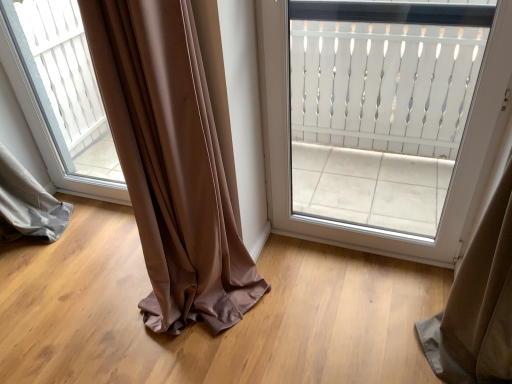
What do you see at coordinates (49, 131) in the screenshot?
I see `transparent glass window at center` at bounding box center [49, 131].

What is the approximate height of transparent glass window at center?

The height of transparent glass window at center is 3.46 feet.

In order to click on transparent glass window at center in this screenshot , I will do `click(49, 131)`.

In order to face white textured door at upper center, should I rotate leftwards or rightwards?

A 14.582 degree turn to the right will do.

This screenshot has height=384, width=512. What do you see at coordinates (354, 225) in the screenshot? I see `white textured door at upper center` at bounding box center [354, 225].

Measure the distance between white textured door at upper center and camera.

The depth of white textured door at upper center is 3.75 feet.

Find the location of a particular element. This screenshot has width=512, height=384. white textured door at upper center is located at coordinates (354, 225).

Where is `transparent glass window at center`? The width and height of the screenshot is (512, 384). transparent glass window at center is located at coordinates (49, 131).

Is transparent glass window at center to the left of white textured door at upper center from the viewer's perspective?

Yes, transparent glass window at center is to the left of white textured door at upper center.

Is transparent glass window at center in front of or behind white textured door at upper center in the image?

transparent glass window at center is behind white textured door at upper center.

Is point (30, 123) positioned before point (375, 230)?

No.

From the image's perspective, is transparent glass window at center below white textured door at upper center?

No, from the image's perspective, transparent glass window at center is not beneath white textured door at upper center.

From a real-world perspective, which is physically above, transparent glass window at center or white textured door at upper center?

In real-world perspective, white textured door at upper center is above.

Can you confirm if transparent glass window at center is thinner than white textured door at upper center?

Yes.

Can you confirm if transparent glass window at center is shorter than white textured door at upper center?

Yes, transparent glass window at center is shorter than white textured door at upper center.

Considering the relative sizes of transparent glass window at center and white textured door at upper center in the image provided, is transparent glass window at center smaller than white textured door at upper center?

Yes, transparent glass window at center is smaller than white textured door at upper center.

Is white textured door at upper center completely or partially inside transparent glass window at center?

No, white textured door at upper center is not inside transparent glass window at center.

Are transparent glass window at center and white textured door at upper center located far from each other?

Yes, transparent glass window at center and white textured door at upper center are quite far apart.

Is transparent glass window at center facing towards white textured door at upper center?

No, transparent glass window at center is not aimed at white textured door at upper center.

I want to click on door below the transparent glass window at center (from the image's perspective), so click(354, 225).

Which is more to the left, white textured door at upper center or transparent glass window at center?

Positioned to the left is transparent glass window at center.

Which object is further away from the camera taking this photo, white textured door at upper center or transparent glass window at center?

transparent glass window at center is behind.

Is point (424, 243) closer or farther from the camera than point (28, 114)?

Point (424, 243) appears to be closer to the viewer than point (28, 114).

From the image's perspective, which object appears higher, white textured door at upper center or transparent glass window at center?

transparent glass window at center is shown above in the image.

From a real-world perspective, is white textured door at upper center located higher than transparent glass window at center?

Yes, from a real-world perspective, white textured door at upper center is on top of transparent glass window at center.

Does white textured door at upper center have a greater width compared to transparent glass window at center?

Yes, white textured door at upper center is wider than transparent glass window at center.

Between white textured door at upper center and transparent glass window at center, which one has more height?

white textured door at upper center.

Is white textured door at upper center bigger or smaller than transparent glass window at center?

white textured door at upper center is bigger than transparent glass window at center.

Is white textured door at upper center outside of transparent glass window at center?

Yes, white textured door at upper center is outside of transparent glass window at center.

Does white textured door at upper center touch transparent glass window at center?

No, white textured door at upper center is not beside transparent glass window at center.

Is white textured door at upper center facing away from transparent glass window at center?

That's not correct — white textured door at upper center is not looking away from transparent glass window at center.

The height and width of the screenshot is (384, 512). Identify the location of door above the transparent glass window at center (from a real-world perspective). (354, 225).

This screenshot has width=512, height=384. I want to click on door below the transparent glass window at center (from the image's perspective), so click(354, 225).

The image size is (512, 384). I want to click on window below the white textured door at upper center (from a real-world perspective), so click(49, 131).